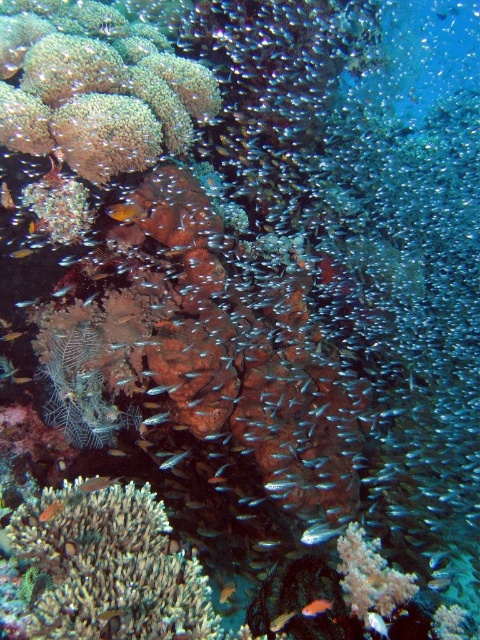
Question: Is orange glossy fish at lower right wider than shiny blue fish at lower center?

Choices:
 (A) no
 (B) yes

Answer: (B)

Question: Where is shiny silver fish at lower right located in relation to shiny blue fish at lower center in the image?

Choices:
 (A) below
 (B) above

Answer: (B)

Question: Is green coral at center further to the viewer compared to shiny silver fish at lower right?

Choices:
 (A) no
 (B) yes

Answer: (A)

Question: Which of the following is the closest to the observer?

Choices:
 (A) (56, 500)
 (B) (277, 627)
 (C) (308, 602)

Answer: (B)

Question: Which object is the closest to the orange matte fish at lower center?

Choices:
 (A) shiny silver fish at lower right
 (B) orange glossy fish at lower right

Answer: (B)

Question: Which object is the farthest from the green coral at center?

Choices:
 (A) orange glossy fish at lower right
 (B) shiny orange fish at center
 (C) shiny blue fish at lower center
 (D) orange matte fish at lower center

Answer: (D)